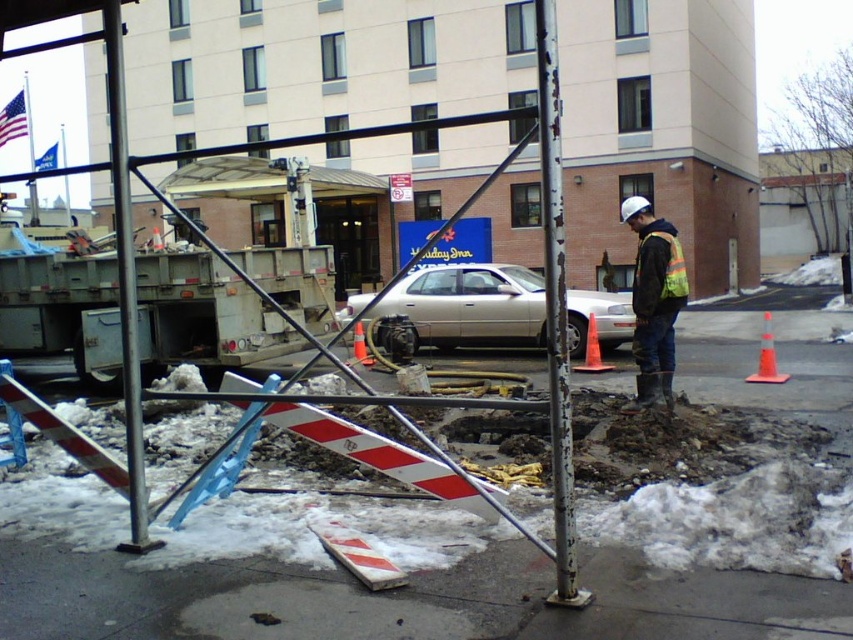
Question: Which object is closer to the camera taking this photo?

Choices:
 (A) reflective yellow-green safety vest at center
 (B) silver metallic sedan at center

Answer: (B)

Question: Which object is the closest to the silver metallic sedan at center?

Choices:
 (A) reflective yellow-green safety vest at center-right
 (B) reflective yellow-green safety vest at center

Answer: (B)

Question: Which of the following is the farthest from the observer?

Choices:
 (A) silver metallic sedan at center
 (B) reflective yellow-green safety vest at center-right
 (C) reflective yellow-green safety vest at center

Answer: (B)

Question: Where is silver metallic sedan at center located in relation to reflective yellow-green safety vest at center in the image?

Choices:
 (A) left
 (B) right

Answer: (A)

Question: Can you confirm if silver metallic sedan at center is positioned to the right of reflective yellow-green safety vest at center-right?

Choices:
 (A) yes
 (B) no

Answer: (B)

Question: In this image, where is reflective yellow-green safety vest at center located relative to reflective yellow-green safety vest at center-right?

Choices:
 (A) left
 (B) right

Answer: (B)